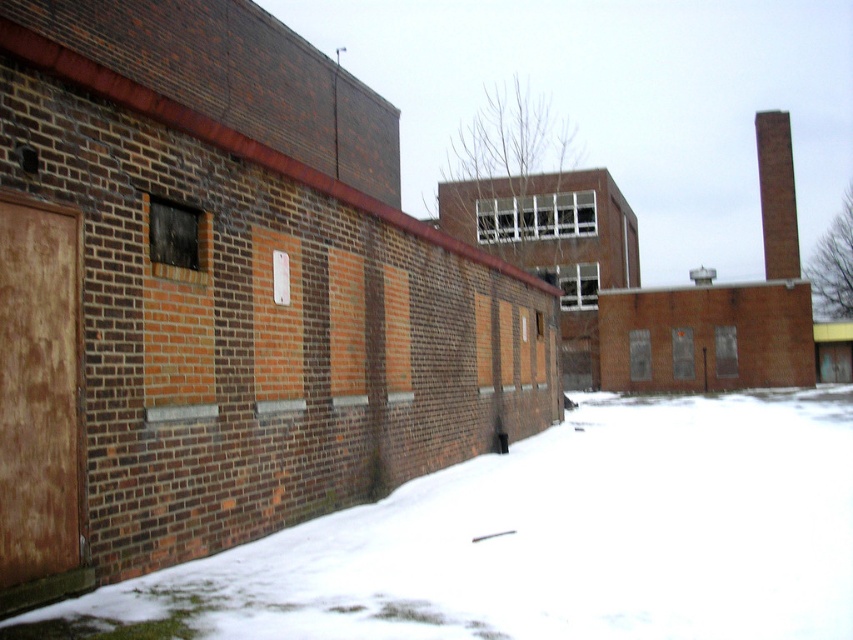
You are standing in front of the brick wall and want to walk to the brown brick chimney at upper right. Which direction should you move relative to the white powdery snow at lower left?

To reach the brown brick chimney at upper right, you should move towards the upper right direction relative to the white powdery snow at lower left, as the chimney is positioned above the snow.

You are standing in front of a snow covered brick wall with a small white sign. You want to reach a point that is 4.71 meters away from you. Can you walk straight ahead to reach the point labeled as point (x=25, y=624)?

The point labeled as point (x=25, y=624) is 4.71 meters away from the viewer. Since the path is clear, you can walk straight ahead to reach it.

You are standing in the urban scene and want to take a photo of both the white powdery snow at lower left and the brown brick chimney at upper right. Which object should you focus on first to ensure both are in clear view?

You should focus on the white powdery snow at lower left first because it is closer to the viewer than the brown brick chimney at upper right, ensuring both will be in clear view when focused on the closer object.